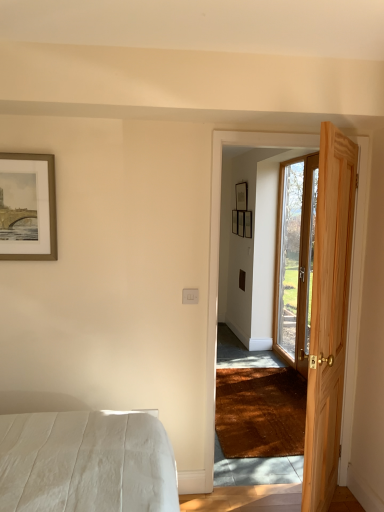
How much space does natural wood door at right, which appears as the second door when viewed from the right, occupy horizontally?

6.38 inches.

Describe the element at coordinates (241, 196) in the screenshot. I see `matte black picture frame at upper center, which is the 1th picture frame in back-to-front order` at that location.

What do you see at coordinates (295, 259) in the screenshot?
I see `clear glass door at right, which is the 2th door from left to right` at bounding box center [295, 259].

Image resolution: width=384 pixels, height=512 pixels. Identify the location of wooden picture frame at center, arranged as the 2th picture frame when viewed from the back. (248, 224).

From the picture: From the image's perspective, is clear glass door at right, which is the 2th door from left to right, beneath wooden picture frame at center, which is counted as the 2th picture frame, starting from the front?

Indeed, from the image's perspective, clear glass door at right, which is the 2th door from left to right, is shown beneath wooden picture frame at center, which is counted as the 2th picture frame, starting from the front.

Can you confirm if clear glass door at right, acting as the first door starting from the right, is thinner than wooden picture frame at center, which is counted as the 2th picture frame, starting from the front?

No.

Is clear glass door at right, which is the 2th door from left to right, to the left of wooden picture frame at center, which is counted as the 2th picture frame, starting from the front, from the viewer's perspective?

Incorrect, clear glass door at right, which is the 2th door from left to right, is not on the left side of wooden picture frame at center, which is counted as the 2th picture frame, starting from the front.

Does clear glass door at right, acting as the first door starting from the right, have a larger size compared to wooden picture frame at center, arranged as the 1th picture frame when viewed from the right?

Indeed, clear glass door at right, acting as the first door starting from the right, has a larger size compared to wooden picture frame at center, arranged as the 1th picture frame when viewed from the right.

Considering the relative positions of natural wood door at right, which appears as the second door when viewed from the right, and matte black picture frame at upper center, which ranks as the third picture frame in front-to-back order, in the image provided, is natural wood door at right, which appears as the second door when viewed from the right, to the left or to the right of matte black picture frame at upper center, which ranks as the third picture frame in front-to-back order,?

Clearly, natural wood door at right, which appears as the second door when viewed from the right, is on the right of matte black picture frame at upper center, which ranks as the third picture frame in front-to-back order, in the image.

Between natural wood door at right, which appears as the second door when viewed from the right, and matte black picture frame at upper center, which ranks as the third picture frame in front-to-back order, which one is positioned behind?

matte black picture frame at upper center, which ranks as the third picture frame in front-to-back order, is behind.

Between natural wood door at right, acting as the second door starting from the back, and matte black picture frame at upper center, which ranks as the third picture frame in front-to-back order, which one has smaller size?

matte black picture frame at upper center, which ranks as the third picture frame in front-to-back order.

From the image's perspective, does gold-framed artwork at upper left, which is the third picture frame from right to left, appear lower than clear glass door at right, arranged as the first door when viewed from the back?

Actually, gold-framed artwork at upper left, which is the third picture frame from right to left, appears above clear glass door at right, arranged as the first door when viewed from the back, in the image.

How distant is gold-framed artwork at upper left, the 1th picture frame in the front-to-back sequence, from clear glass door at right, which is the 2th door from left to right?

The distance of gold-framed artwork at upper left, the 1th picture frame in the front-to-back sequence, from clear glass door at right, which is the 2th door from left to right, is 3.06 meters.

From a real-world perspective, is gold-framed artwork at upper left, the 1th picture frame in the front-to-back sequence, on top of clear glass door at right, which appears as the second door when viewed from the front?

Yes, from a real-world perspective, gold-framed artwork at upper left, the 1th picture frame in the front-to-back sequence, is over clear glass door at right, which appears as the second door when viewed from the front

Does point (41, 180) appear closer or farther from the camera than point (297, 165)?

Point (41, 180).

Can you tell me how much matte black picture frame at upper center, which appears as the second picture frame when viewed from the left, and wooden picture frame at center, which is counted as the 2th picture frame, starting from the front, differ in facing direction?

The facing directions of matte black picture frame at upper center, which appears as the second picture frame when viewed from the left, and wooden picture frame at center, which is counted as the 2th picture frame, starting from the front, are 1.28 degrees apart.

Is point (245, 205) closer or farther from the camera than point (250, 226)?

Point (245, 205) appears to be farther away from the viewer than point (250, 226).

Who is bigger, matte black picture frame at upper center, arranged as the second picture frame when viewed from the right, or wooden picture frame at center, which is counted as the third picture frame, starting from the left?

With larger size is matte black picture frame at upper center, arranged as the second picture frame when viewed from the right.

Considering the relative sizes of matte black picture frame at upper center, which is the 1th picture frame in back-to-front order, and wooden picture frame at center, arranged as the 2th picture frame when viewed from the back, in the image provided, is matte black picture frame at upper center, which is the 1th picture frame in back-to-front order, taller than wooden picture frame at center, arranged as the 2th picture frame when viewed from the back,?

No, matte black picture frame at upper center, which is the 1th picture frame in back-to-front order, is not taller than wooden picture frame at center, arranged as the 2th picture frame when viewed from the back.

Considering the points (245, 211) and (307, 228), which point is in front, point (245, 211) or point (307, 228)?

The point (307, 228) is closer to the camera.

Choose the correct answer: Is wooden picture frame at center, which is counted as the third picture frame, starting from the left, inside clear glass door at right, which is the 2th door from left to right, or outside it?

wooden picture frame at center, which is counted as the third picture frame, starting from the left, is not inside clear glass door at right, which is the 2th door from left to right, it's outside.

How distant is wooden picture frame at center, arranged as the 2th picture frame when viewed from the back, from clear glass door at right, arranged as the first door when viewed from the back?

24.57 inches.

Who is taller, wooden picture frame at center, which is counted as the 2th picture frame, starting from the front, or clear glass door at right, arranged as the first door when viewed from the back?

→ Standing taller between the two is clear glass door at right, arranged as the first door when viewed from the back.

Considering the relative sizes of wooden picture frame at center, arranged as the 1th picture frame when viewed from the right, and matte black picture frame at upper center, which is the 1th picture frame in back-to-front order, in the image provided, is wooden picture frame at center, arranged as the 1th picture frame when viewed from the right, wider than matte black picture frame at upper center, which is the 1th picture frame in back-to-front order,?

No, wooden picture frame at center, arranged as the 1th picture frame when viewed from the right, is not wider than matte black picture frame at upper center, which is the 1th picture frame in back-to-front order.

Who is smaller, wooden picture frame at center, arranged as the 1th picture frame when viewed from the right, or matte black picture frame at upper center, which ranks as the third picture frame in front-to-back order?

wooden picture frame at center, arranged as the 1th picture frame when viewed from the right.

Is wooden picture frame at center, arranged as the 2th picture frame when viewed from the back, next to matte black picture frame at upper center, which ranks as the third picture frame in front-to-back order?

wooden picture frame at center, arranged as the 2th picture frame when viewed from the back, is not next to matte black picture frame at upper center, which ranks as the third picture frame in front-to-back order, and they're not touching.

Is wooden picture frame at center, which is counted as the 2th picture frame, starting from the front, to the left or to the right of matte black picture frame at upper center, which ranks as the third picture frame in front-to-back order, in the image?

wooden picture frame at center, which is counted as the 2th picture frame, starting from the front, is to the right of matte black picture frame at upper center, which ranks as the third picture frame in front-to-back order.

Considering the sizes of objects gold-framed artwork at upper left, the 1th picture frame in the front-to-back sequence, and wooden picture frame at center, arranged as the 1th picture frame when viewed from the right, in the image provided, who is smaller, gold-framed artwork at upper left, the 1th picture frame in the front-to-back sequence, or wooden picture frame at center, arranged as the 1th picture frame when viewed from the right,?

Smaller between the two is wooden picture frame at center, arranged as the 1th picture frame when viewed from the right.

Considering the positions of objects gold-framed artwork at upper left, which is the third picture frame from right to left, and wooden picture frame at center, which is counted as the 2th picture frame, starting from the front, in the image provided, who is more to the right, gold-framed artwork at upper left, which is the third picture frame from right to left, or wooden picture frame at center, which is counted as the 2th picture frame, starting from the front,?

From the viewer's perspective, wooden picture frame at center, which is counted as the 2th picture frame, starting from the front, appears more on the right side.

From a real-world perspective, which is physically above, gold-framed artwork at upper left, which is the third picture frame from right to left, or wooden picture frame at center, which is counted as the 2th picture frame, starting from the front?

From a 3D spatial view, gold-framed artwork at upper left, which is the third picture frame from right to left, is above.

You are a GUI agent. You are given a task and a screenshot of the screen. Output one action in this format:
    pyautogui.click(x=<x>, y=<y>)
    Task: Click on the 1st picture frame behind the clear glass door at right, which appears as the second door when viewed from the front, counting from the anchor's position
    The image size is (384, 512).
    Given the screenshot: What is the action you would take?
    pyautogui.click(x=248, y=224)

This screenshot has width=384, height=512. Identify the location of the 1st door counting from the right side of the matte black picture frame at upper center, which is the 1th picture frame in back-to-front order. (329, 316).

When comparing their distances from gold-framed artwork at upper left, the 1th picture frame in the front-to-back sequence, does natural wood door at right, acting as the second door starting from the back, or wooden picture frame at center, which is counted as the 2th picture frame, starting from the front, seem further?

Based on the image, wooden picture frame at center, which is counted as the 2th picture frame, starting from the front, appears to be further to gold-framed artwork at upper left, the 1th picture frame in the front-to-back sequence.

When comparing their distances from natural wood door at right, which appears as the second door when viewed from the right, does matte black picture frame at upper center, which ranks as the third picture frame in front-to-back order, or gold-framed artwork at upper left, which ranks as the first picture frame in left-to-right order, seem further?

matte black picture frame at upper center, which ranks as the third picture frame in front-to-back order.

Estimate the real-world distances between objects in this image. Which object is closer to clear glass door at right, acting as the first door starting from the right, gold-framed artwork at upper left, which is the third picture frame from right to left, or wooden picture frame at center, arranged as the 2th picture frame when viewed from the back?

wooden picture frame at center, arranged as the 2th picture frame when viewed from the back, is closer to clear glass door at right, acting as the first door starting from the right.

In the scene shown: Considering their positions, is matte black picture frame at upper center, which appears as the second picture frame when viewed from the left, positioned closer to gold-framed artwork at upper left, which ranks as the first picture frame in left-to-right order, than wooden picture frame at center, which is counted as the 2th picture frame, starting from the front?

The object closer to gold-framed artwork at upper left, which ranks as the first picture frame in left-to-right order, is wooden picture frame at center, which is counted as the 2th picture frame, starting from the front.

Estimate the real-world distances between objects in this image. Which object is closer to clear glass door at right, arranged as the first door when viewed from the back, gold-framed artwork at upper left, which ranks as the first picture frame in left-to-right order, or natural wood door at right, positioned as the first door in front-to-back order?

natural wood door at right, positioned as the first door in front-to-back order.

Considering their positions, is matte black picture frame at upper center, which appears as the second picture frame when viewed from the left, positioned further to clear glass door at right, which appears as the second door when viewed from the front, than wooden picture frame at center, arranged as the 2th picture frame when viewed from the back?

Among the two, matte black picture frame at upper center, which appears as the second picture frame when viewed from the left, is located further to clear glass door at right, which appears as the second door when viewed from the front.

When comparing their distances from wooden picture frame at center, arranged as the 1th picture frame when viewed from the right, does natural wood door at right, acting as the second door starting from the back, or matte black picture frame at upper center, which appears as the second picture frame when viewed from the left, seem further?

Based on the image, natural wood door at right, acting as the second door starting from the back, appears to be further to wooden picture frame at center, arranged as the 1th picture frame when viewed from the right.

Looking at the image, which one is located closer to matte black picture frame at upper center, which ranks as the third picture frame in front-to-back order, clear glass door at right, acting as the first door starting from the right, or gold-framed artwork at upper left, which is the third picture frame from right to left?

clear glass door at right, acting as the first door starting from the right, is closer to matte black picture frame at upper center, which ranks as the third picture frame in front-to-back order.

Identify the location of door between natural wood door at right, acting as the second door starting from the back, and wooden picture frame at center, which is counted as the 2th picture frame, starting from the front, from front to back. This screenshot has width=384, height=512. coord(295,259).

You are a GUI agent. You are given a task and a screenshot of the screen. Output one action in this format:
    pyautogui.click(x=<x>, y=<y>)
    Task: Click on the picture frame between natural wood door at right, which appears as the second door when viewed from the right, and wooden picture frame at center, which is counted as the third picture frame, starting from the left, along the z-axis
    This screenshot has width=384, height=512.
    Given the screenshot: What is the action you would take?
    pyautogui.click(x=27, y=207)

This screenshot has width=384, height=512. In order to click on picture frame located between clear glass door at right, which is the 2th door from left to right, and matte black picture frame at upper center, which appears as the second picture frame when viewed from the left, in the depth direction in this screenshot , I will do `click(248, 224)`.

This screenshot has height=512, width=384. I want to click on door positioned between gold-framed artwork at upper left, the 1th picture frame in the front-to-back sequence, and wooden picture frame at center, arranged as the 1th picture frame when viewed from the right, from near to far, so pos(295,259).